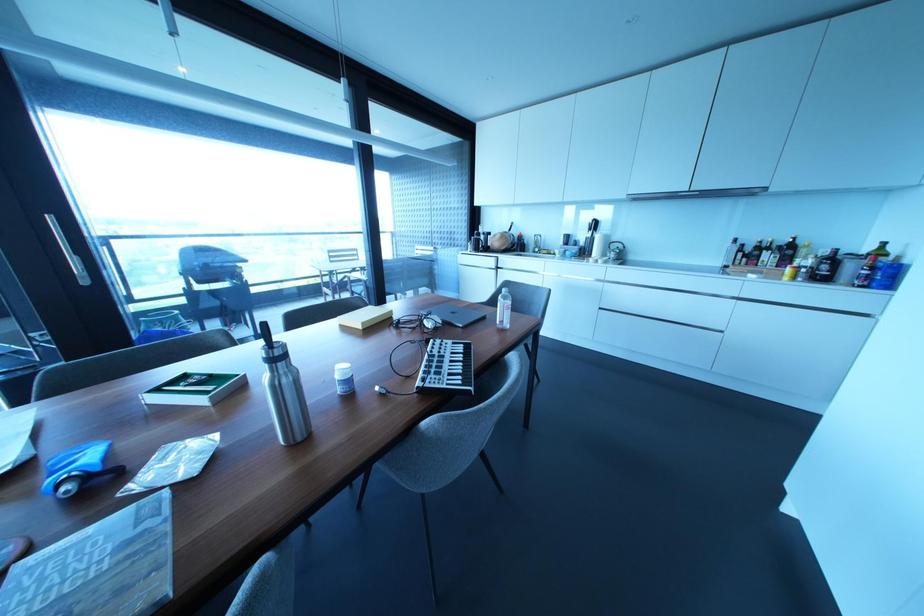
Find where to press the music keyboard key. Please return your answer as a coordinate pair (x, y).

(445, 368)